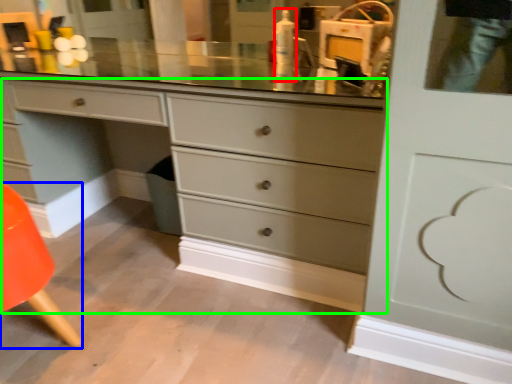
Question: Based on their relative distances, which object is nearer to toiletry (highlighted by a red box)? Choose from armchair (highlighted by a blue box) and chest of drawers (highlighted by a green box).

Choices:
 (A) armchair
 (B) chest of drawers

Answer: (B)